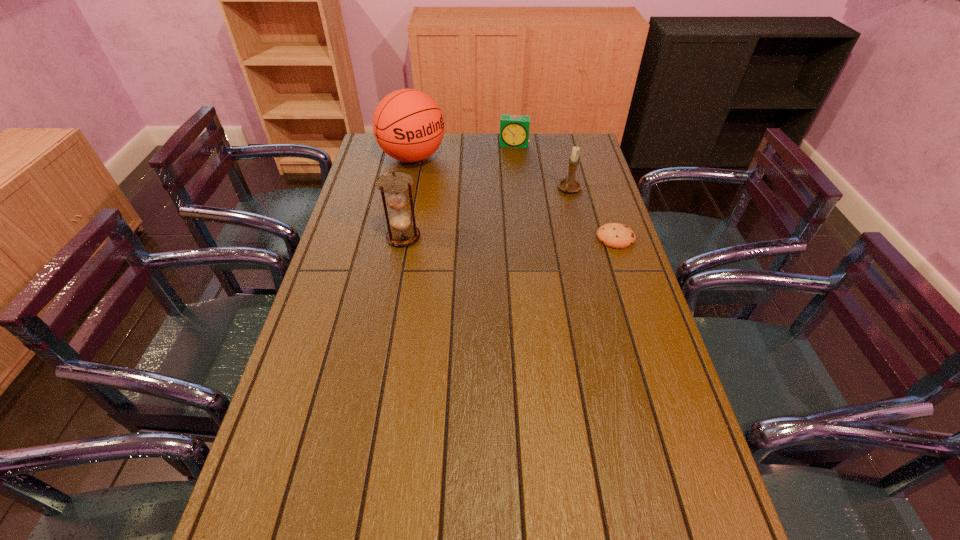
Identify the location of object identified as the third closest to the third object from left to right. (614, 235).

You are a GUI agent. You are given a task and a screenshot of the screen. Output one action in this format:
    pyautogui.click(x=<x>, y=<y>)
    Task: Click on the vacant space that satisfies the following two spatial constraints: 1. on the back side of the alarm clock; 2. on the left side of the tallest object
    This screenshot has width=960, height=540.
    Given the screenshot: What is the action you would take?
    pyautogui.click(x=416, y=145)